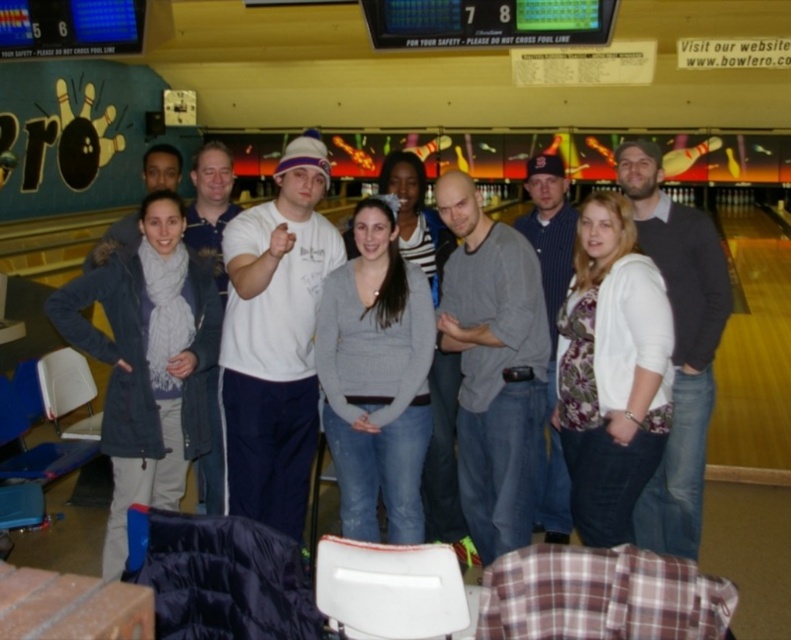
You are standing in the bowling alley and see two points marked in the scene. Which point is closer to you, point [475,401] or point [651,221]?

Point [475,401] is closer to the viewer than point [651,221].